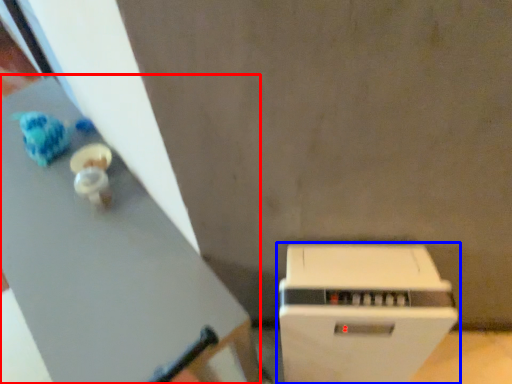
Question: Which object appears closest to the camera in this image, table (highlighted by a red box) or home appliance (highlighted by a blue box)?

Choices:
 (A) table
 (B) home appliance

Answer: (B)